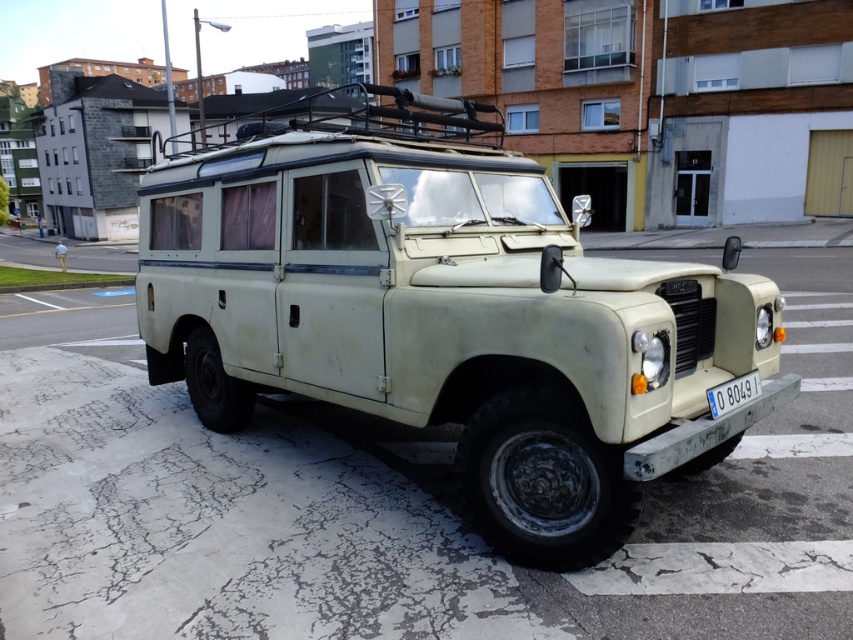
You are a photographer setting up a shot of the matte cream jeep at center and the white plastic license plate at lower center. Which object should you focus on first if you want to capture both in the frame without moving the camera?

The matte cream jeep at center is bigger than the white plastic license plate at lower center, so you should focus on the matte cream jeep at center first to ensure it fills the frame appropriately before adjusting for the smaller license plate.

You are standing in front of the vintage Land Rover Series III. You notice the matte cream jeep at center and the white plastic license plate at lower center. Which object is higher up in the scene?

The matte cream jeep at center is taller than the white plastic license plate at lower center, so the matte cream jeep at center is higher up in the scene.

You are a photographer trying to take a clear photo of the white plastic license plate at lower center. However, the matte cream jeep at center is blocking your view. Can you move the license plate to a better position?

The matte cream jeep at center is positioned over the white plastic license plate at lower center, so you cannot move the license plate without moving the jeep first.